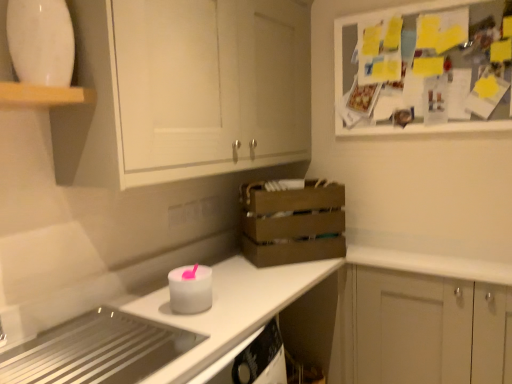
Question: Can you confirm if brown wooden crate at center is shorter than white matte candle at center, the 2th appliance ordered from the bottom?

Choices:
 (A) no
 (B) yes

Answer: (A)

Question: From a real-world perspective, is brown wooden crate at center over white matte candle at center, placed as the 2th appliance when sorted from top to bottom?

Choices:
 (A) yes
 (B) no

Answer: (A)

Question: Can you confirm if brown wooden crate at center is positioned to the right of white matte candle at center, placed as the 2th appliance when sorted from top to bottom?

Choices:
 (A) yes
 (B) no

Answer: (A)

Question: Is there a large distance between brown wooden crate at center and white matte candle at center, the 2th appliance ordered from the bottom?

Choices:
 (A) no
 (B) yes

Answer: (A)

Question: From the image's perspective, is brown wooden crate at center above white matte candle at center, the 2th appliance ordered from the bottom?

Choices:
 (A) no
 (B) yes

Answer: (B)

Question: In the image, is white matte cabinet at lower right, which appears as the second cabinetry when viewed from the left, positioned in front of or behind white glossy countertop at lower left?

Choices:
 (A) behind
 (B) front

Answer: (A)

Question: Would you say white matte cabinet at lower right, which is the first cabinetry in right-to-left order, is to the left or to the right of white glossy countertop at lower left in the picture?

Choices:
 (A) right
 (B) left

Answer: (A)

Question: From a real-world perspective, is white matte cabinet at lower right, which appears as the second cabinetry when viewed from the left, physically located above or below white glossy countertop at lower left?

Choices:
 (A) below
 (B) above

Answer: (A)

Question: In terms of height, does white matte cabinet at lower right, which is the first cabinetry in right-to-left order, look taller or shorter compared to white glossy countertop at lower left?

Choices:
 (A) short
 (B) tall

Answer: (B)

Question: From the image's perspective, is white glossy countertop at lower left positioned above or below white matte cabinet at upper left, placed as the second cabinetry when sorted from right to left?

Choices:
 (A) below
 (B) above

Answer: (A)

Question: Based on their sizes in the image, would you say white glossy countertop at lower left is bigger or smaller than white matte cabinet at upper left, placed as the second cabinetry when sorted from right to left?

Choices:
 (A) small
 (B) big

Answer: (A)

Question: Is white glossy countertop at lower left wider or thinner than white matte cabinet at upper left, the 2th cabinetry from the bottom?

Choices:
 (A) thin
 (B) wide

Answer: (B)

Question: Is white glossy countertop at lower left inside or outside of white matte cabinet at upper left, the 1th cabinetry viewed from the left?

Choices:
 (A) inside
 (B) outside

Answer: (B)

Question: Looking at the image, does white matte cabinet at upper left, the 2th cabinetry from the bottom, seem bigger or smaller compared to brown wooden crate at center?

Choices:
 (A) big
 (B) small

Answer: (A)

Question: Considering their positions, is white matte cabinet at upper left, the 1th cabinetry viewed from the left, located in front of or behind brown wooden crate at center?

Choices:
 (A) front
 (B) behind

Answer: (A)